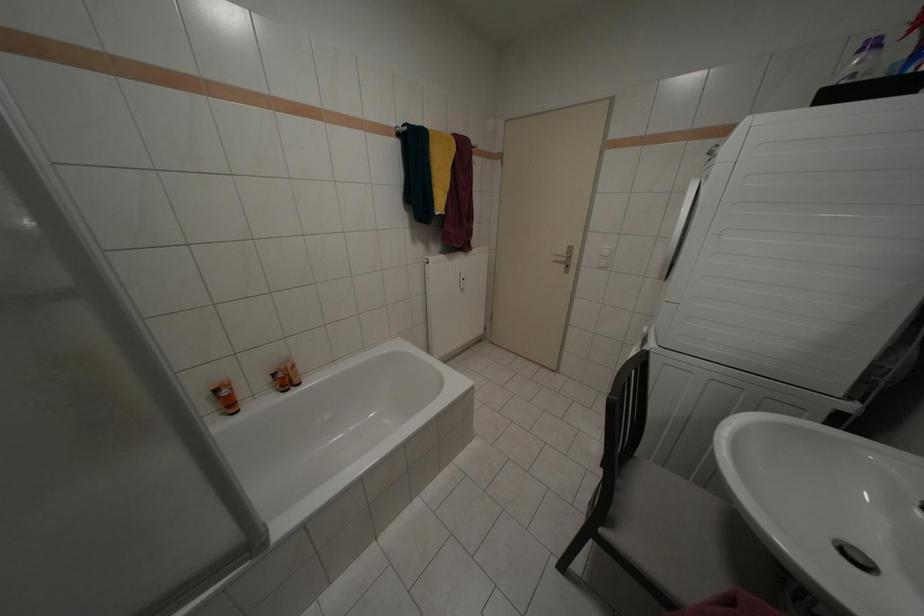
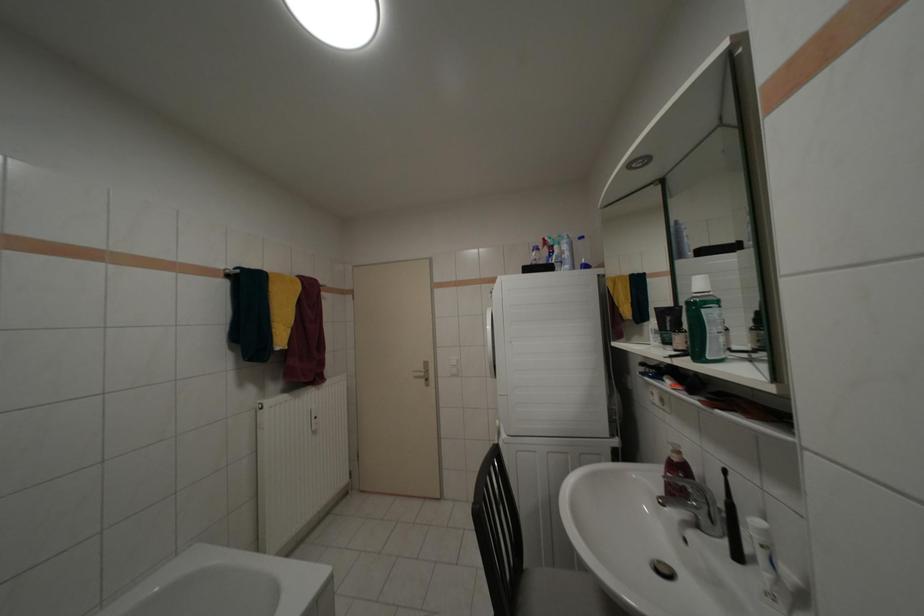
Based on the photo, how did the camera likely rotate?

The rotation direction of the camera is right-up.